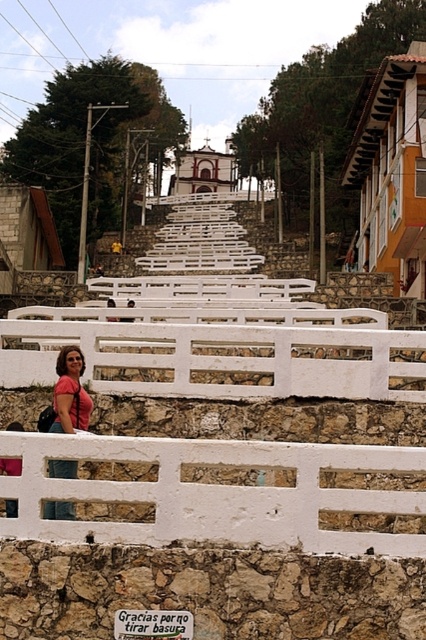
Question: Which point is closer to the camera?

Choices:
 (A) (60, 532)
 (B) (62, 465)

Answer: (A)

Question: Which point is closer to the camera?

Choices:
 (A) pink fabric bag at lower left
 (B) white stone fence at lower center

Answer: (B)

Question: Does white painted wood fence at lower center appear under pink fabric bag at lower left?

Choices:
 (A) no
 (B) yes

Answer: (A)

Question: Based on their relative distances, which object is nearer to the pink fabric bag at lower left?

Choices:
 (A) white painted wood fence at lower center
 (B) white stone fence at lower center

Answer: (B)

Question: From the image, what is the correct spatial relationship of white painted wood fence at lower center in relation to pink fabric bag at lower left?

Choices:
 (A) right
 (B) left

Answer: (A)

Question: Can you confirm if white stone fence at lower center is positioned to the right of white painted wood fence at lower center?

Choices:
 (A) yes
 (B) no

Answer: (A)